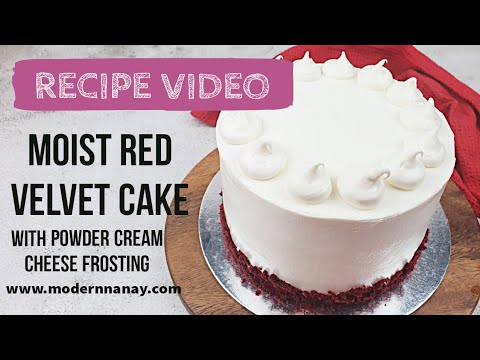
Where is `red towel`? red towel is located at coordinates (461, 100).